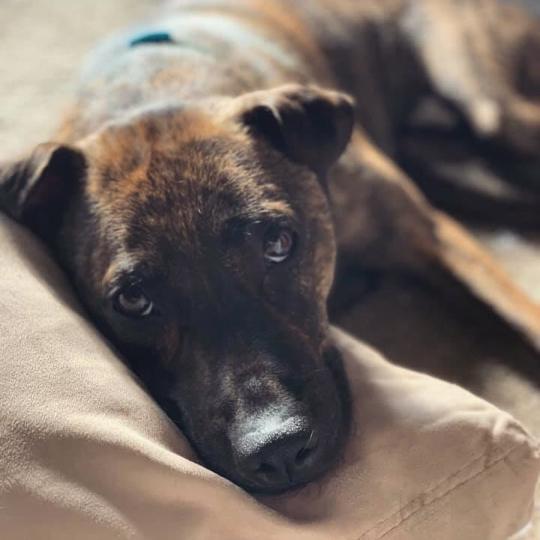
Find the location of a particular element. The image size is (540, 540). corner is located at coordinates (24, 26).